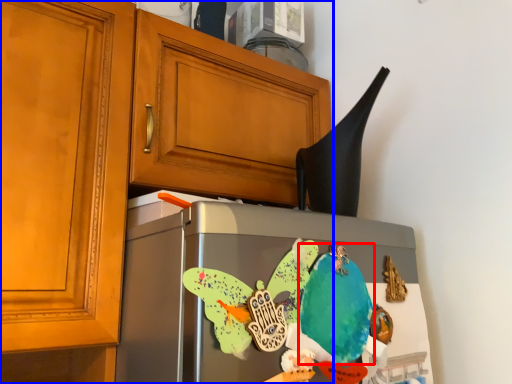
Question: Which object is further to the camera taking this photo, parrot (highlighted by a red box) or cabinetry (highlighted by a blue box)?

Choices:
 (A) parrot
 (B) cabinetry

Answer: (A)